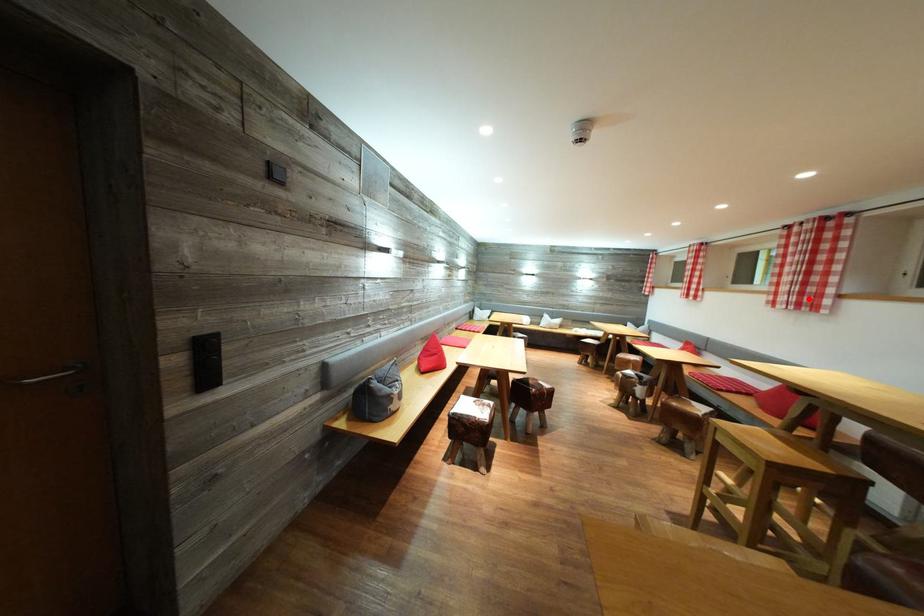
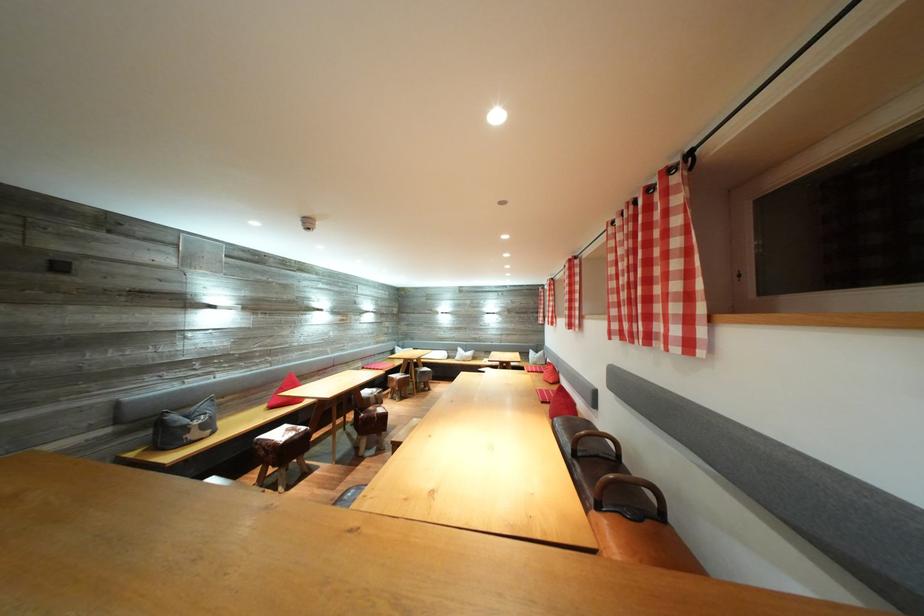
Locate, in the second image, the point that corresponds to the highlighted location in the first image.

(578, 322)